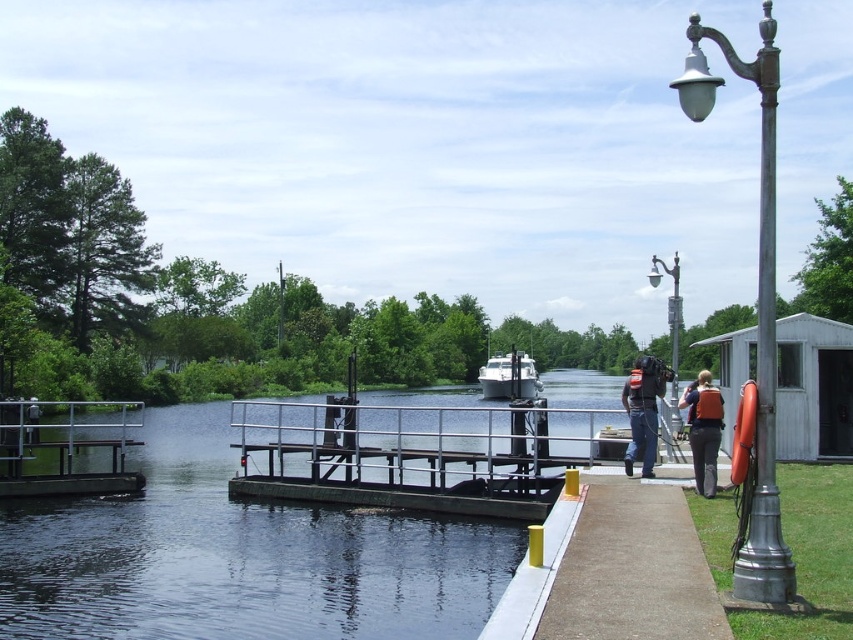
Consider the image. You are a visitor at the riverside lock facility. You notice two light sources nearby. One is the bronze metallic lamp post at right and the other is the metallic gray streetlight at upper right. Which of these two is taller?

The bronze metallic lamp post at right is much taller than the metallic gray streetlight at upper right.